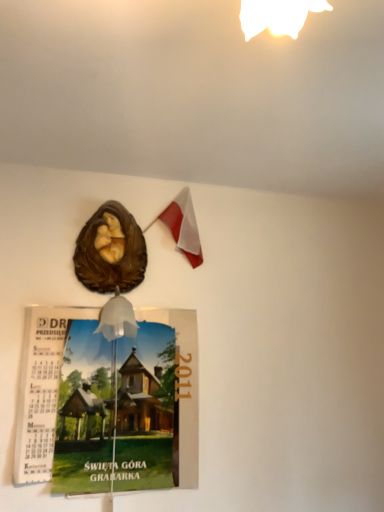
Question: From a real-world perspective, is polish flag at upper center positioned above or below matte paper calendar at lower left?

Choices:
 (A) above
 (B) below

Answer: (A)

Question: Considering the relative positions of polish flag at upper center and matte paper calendar at lower left in the image provided, is polish flag at upper center to the left or to the right of matte paper calendar at lower left?

Choices:
 (A) left
 (B) right

Answer: (B)

Question: Estimate the real-world distances between objects in this image. Which object is closer to the matte paper calendar at lower left?

Choices:
 (A) polish flag at upper center
 (B) brown glossy sculpture at upper center

Answer: (B)

Question: Estimate the real-world distances between objects in this image. Which object is closer to the brown glossy sculpture at upper center?

Choices:
 (A) matte paper calendar at lower left
 (B) polish flag at upper center

Answer: (B)